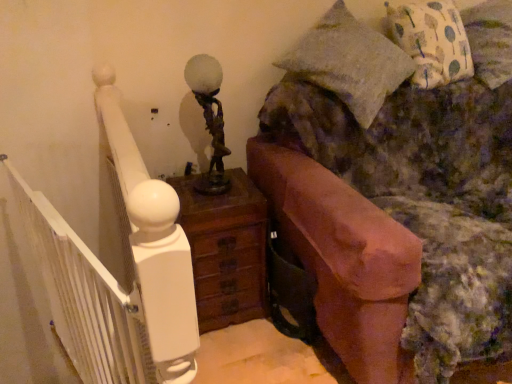
This screenshot has height=384, width=512. I want to click on vacant area on top of brown wooden nightstand at center (from a real-world perspective), so click(206, 188).